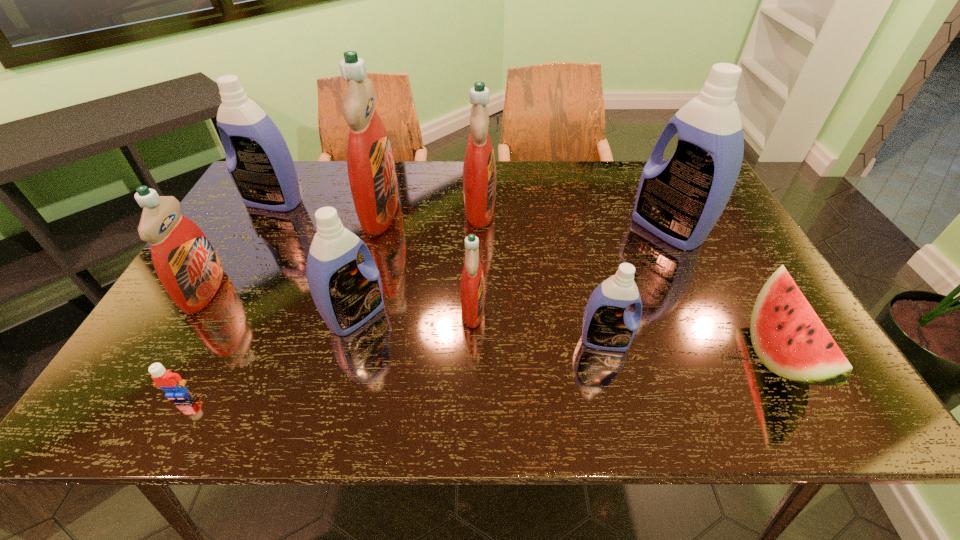
Where is `the second shortest object`? the second shortest object is located at coordinates (788, 337).

The image size is (960, 540). Find the location of `green watermelon`. green watermelon is located at coordinates (788, 337).

The image size is (960, 540). Identify the location of white Lego. pos(172,383).

Where is `Lego`? The width and height of the screenshot is (960, 540). Lego is located at coordinates (172, 383).

Image resolution: width=960 pixels, height=540 pixels. I want to click on free location located 0.300m on the front surface of the third red detergent from right to left, so click(499, 212).

Locate an element on the screen. free location located on the left of the rightmost blue detergent is located at coordinates (604, 229).

I want to click on free space located 0.330m on the front surface of the second biggest red detergent, so [x=605, y=209].

Find the location of a particular element. vacant space situated on the right of the leftmost blue detergent is located at coordinates (380, 201).

Image resolution: width=960 pixels, height=540 pixels. Identify the location of blank space located on the front surface of the leftmost red detergent. (338, 291).

Where is `free space located on the right of the second smallest blue detergent`? The height and width of the screenshot is (540, 960). free space located on the right of the second smallest blue detergent is located at coordinates (452, 315).